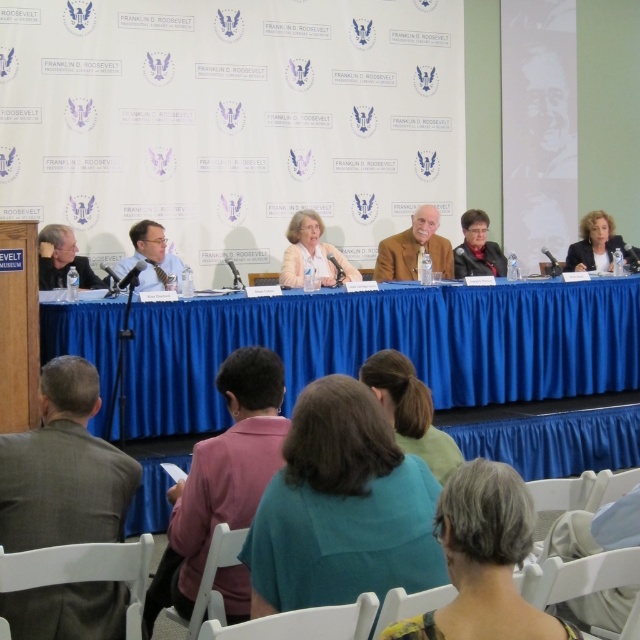
Question: Is gray suit at left smaller than matte black jacket at upper right?

Choices:
 (A) no
 (B) yes

Answer: (B)

Question: Which point is closer to the camera taking this photo?

Choices:
 (A) (19, 604)
 (B) (388, 547)
 (C) (228, 582)
 (D) (177, 365)

Answer: (B)

Question: Does teal fabric shirt at center lie behind teal fabric ponytail at center?

Choices:
 (A) yes
 (B) no

Answer: (B)

Question: Can you confirm if gray textured hair at center is positioned above matte black jacket at upper right?

Choices:
 (A) no
 (B) yes

Answer: (A)

Question: Which object is the closest to the teal fabric jacket at center?

Choices:
 (A) light pink fabric jacket at center
 (B) gray suit at left
 (C) teal fabric ponytail at center

Answer: (B)

Question: Which object appears farthest from the camera in this image?

Choices:
 (A) light pink fabric jacket at center
 (B) matte black jacket at left
 (C) teal fabric jacket at center
 (D) matte black jacket at center

Answer: (D)